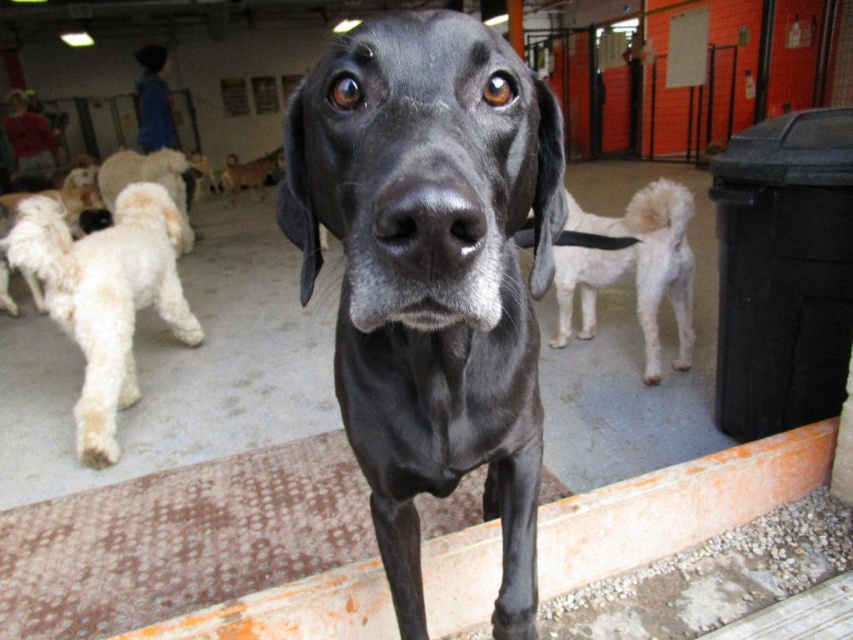
Question: Based on their relative distances, which object is farther from the white fluffy dog at left?

Choices:
 (A) white fluffy dog at center
 (B) black glossy dog at center

Answer: (B)

Question: Among these objects, which one is farthest from the camera?

Choices:
 (A) black glossy dog at center
 (B) white fluffy dog at left
 (C) white fluffy dog at center

Answer: (C)

Question: Which point is farther from the camera taking this photo?

Choices:
 (A) (106, 404)
 (B) (517, 456)
 (C) (648, 269)

Answer: (C)

Question: From the image, what is the correct spatial relationship of black glossy dog at center in relation to white fluffy dog at center?

Choices:
 (A) above
 (B) below

Answer: (B)

Question: Does white fluffy dog at left appear under white fluffy dog at center?

Choices:
 (A) yes
 (B) no

Answer: (A)

Question: From the image, what is the correct spatial relationship of black glossy dog at center in relation to white fluffy dog at center?

Choices:
 (A) left
 (B) right

Answer: (A)